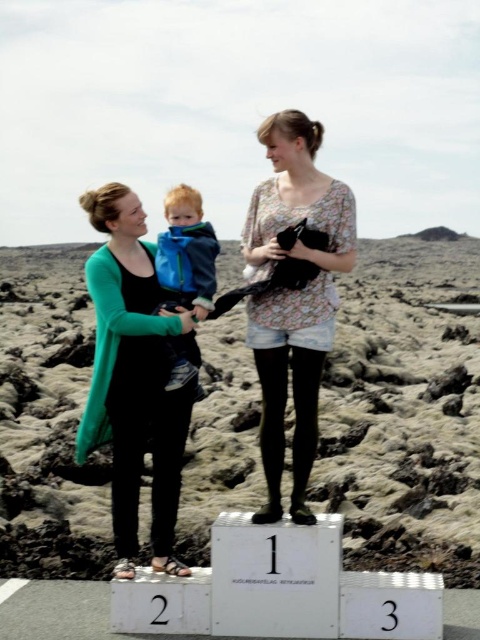
You are a photographer trying to capture a closeup of the green matte cardigan at left. You notice a point marked at coordinates [133,378]. Based on the scene description, where exactly is this point located on the green matte cardigan at left?

The point at coordinates [133,378] is located on the green matte cardigan at left.